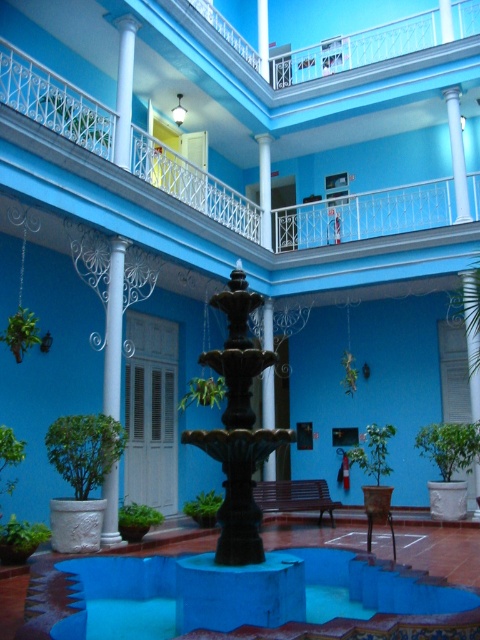
Question: Which point is farther to the camera?

Choices:
 (A) (458, 112)
 (B) (123, 56)
 (C) (267, 152)

Answer: (C)

Question: Estimate the real-world distances between objects in this image. Which object is closer to the white wrought iron balcony at upper center?

Choices:
 (A) white glossy pillar at center
 (B) white marble column at center
 (C) white glossy column at center

Answer: (A)

Question: Which object is the farthest from the black polished pillar at center?

Choices:
 (A) blue concrete fountain at center
 (B) white wrought iron balcony at upper center

Answer: (A)

Question: Is white wrought iron balcony at upper center smaller than white glossy pillar at center?

Choices:
 (A) yes
 (B) no

Answer: (B)

Question: Can you confirm if white glossy column at upper center is positioned below white glossy pillar at center?

Choices:
 (A) no
 (B) yes

Answer: (A)

Question: Can you confirm if white wrought iron balcony at upper center is smaller than white glossy pillar at center?

Choices:
 (A) no
 (B) yes

Answer: (A)